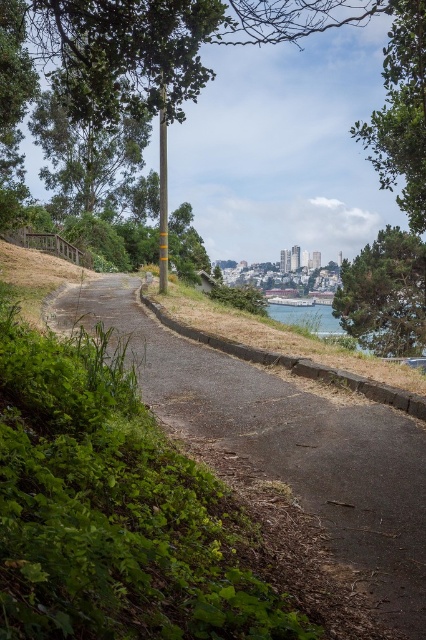
Question: Does green grass at lower left appear under green textured tree at right?

Choices:
 (A) no
 (B) yes

Answer: (B)

Question: Which point is closer to the camera?

Choices:
 (A) green textured tree at right
 (B) green leafy tree at left

Answer: (B)

Question: Which point is closer to the camera?

Choices:
 (A) green grass at lower left
 (B) green textured tree at right
 (C) green leafy tree at left

Answer: (A)

Question: Which of these objects is positioned farthest from the green textured tree at right?

Choices:
 (A) green leafy tree at left
 (B) clear water at lower right

Answer: (A)

Question: Is green leafy tree at left closer to the viewer compared to green textured tree at right?

Choices:
 (A) yes
 (B) no

Answer: (A)

Question: Is green grass at lower left wider than green leafy tree at left?

Choices:
 (A) yes
 (B) no

Answer: (B)